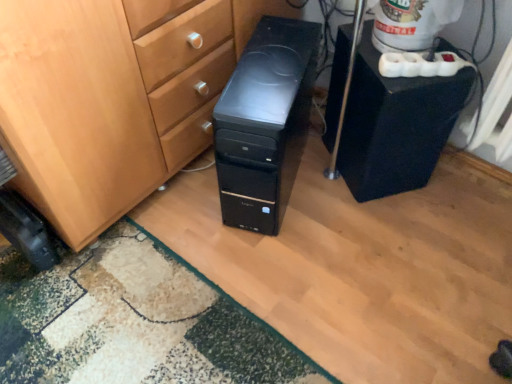
Find the location of a particular element. The width and height of the screenshot is (512, 384). spots to the right of black rubber wheel at lower left is located at coordinates (102, 263).